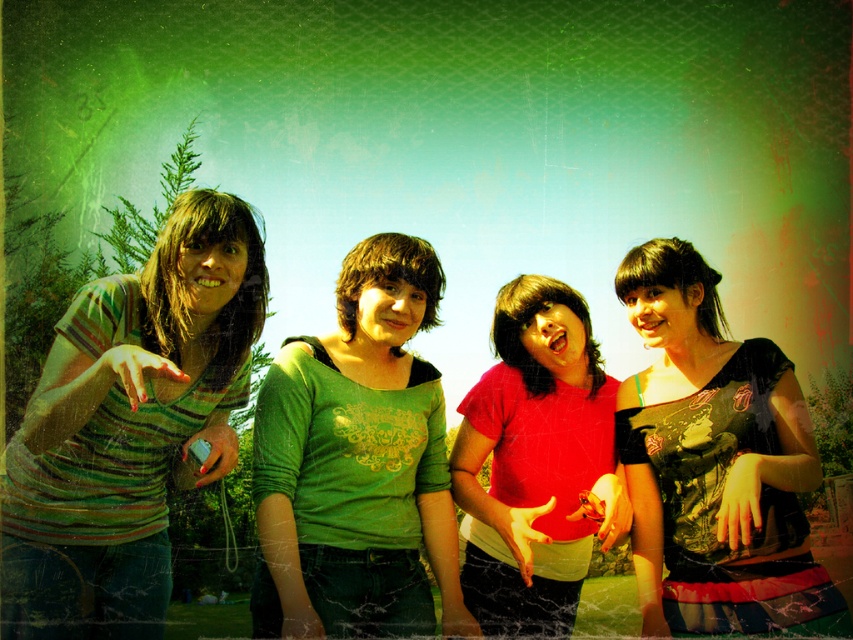
Based on the scene description, where is the green matte shirt at center located in the image?

The green matte shirt at center is located at point (357, 461).

You are a photographer trying to adjust the focus of your camera. You have two subjects in the frame, the green matte shirt at center and the matte black dress at center. Which subject should you focus on first if you want to ensure the taller subject is in sharp focus?

The green matte shirt at center is taller than the matte black dress at center, so you should focus on the green matte shirt at center first to ensure the taller subject is in sharp focus.